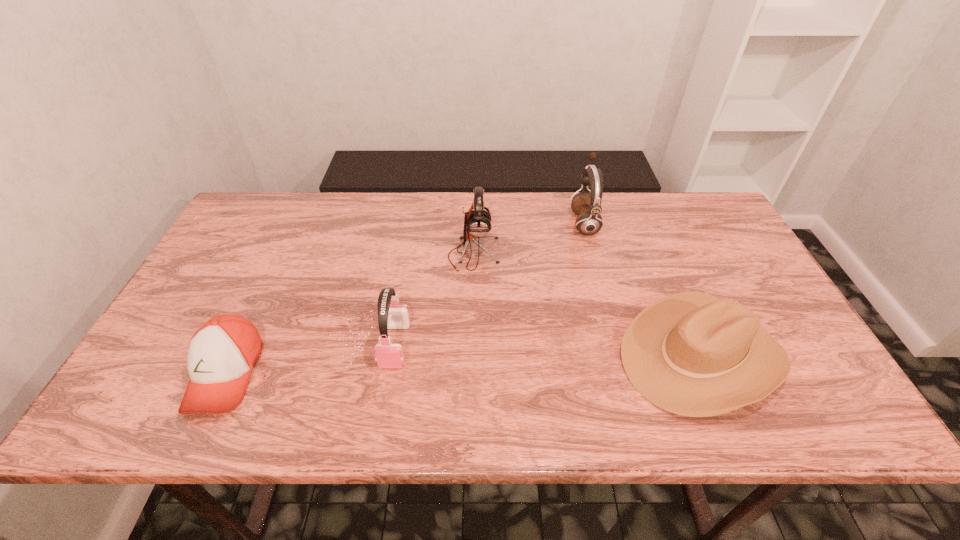
You are a GUI agent. You are given a task and a screenshot of the screen. Output one action in this format:
    pyautogui.click(x=<x>, y=<y>)
    Task: Click on the vacant space situated on the left of the second earphone from right to left
    The width and height of the screenshot is (960, 540).
    Given the screenshot: What is the action you would take?
    pyautogui.click(x=420, y=254)

Identify the location of vacant space located on the outer surface of the nearest earphone. The width and height of the screenshot is (960, 540). (387, 393).

You are a GUI agent. You are given a task and a screenshot of the screen. Output one action in this format:
    pyautogui.click(x=<x>, y=<y>)
    Task: Click on the vacant space located on the back of the cowboy hat
    The image size is (960, 540).
    Given the screenshot: What is the action you would take?
    pyautogui.click(x=655, y=246)

Find the location of a particular element. The image size is (960, 540). cowboy hat located at the near edge is located at coordinates (692, 354).

Identify the location of baseball cap present at the near edge. (221, 354).

This screenshot has width=960, height=540. Find the location of `object that is at the left edge`. object that is at the left edge is located at coordinates (221, 354).

You are a GUI agent. You are given a task and a screenshot of the screen. Output one action in this format:
    pyautogui.click(x=<x>, y=<y>)
    Task: Click on the object present at the right edge
    
    Given the screenshot: What is the action you would take?
    click(x=692, y=354)

Find the location of `object located in the near left corner section of the desktop`. object located in the near left corner section of the desktop is located at coordinates (221, 354).

Identify the location of object positioned at the near right corner. This screenshot has height=540, width=960. (692, 354).

The width and height of the screenshot is (960, 540). I want to click on vacant space at the far edge of the desktop, so click(405, 204).